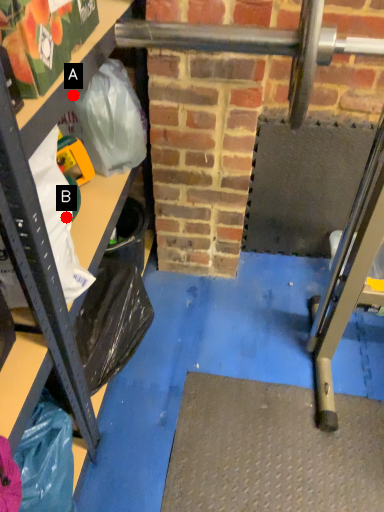
Question: Two points are circled on the image, labeled by A and B beside each circle. Among these points, which one is farthest from the camera?

Choices:
 (A) A is further
 (B) B is further

Answer: (B)